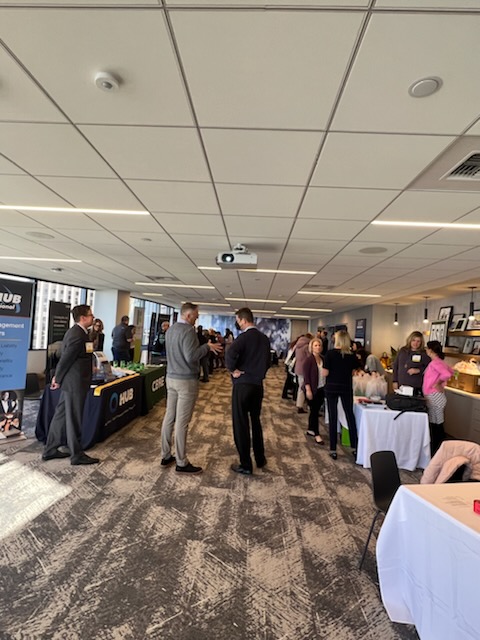
Locate an element on the screen. The image size is (480, 640). white table cloth is located at coordinates (435, 560).